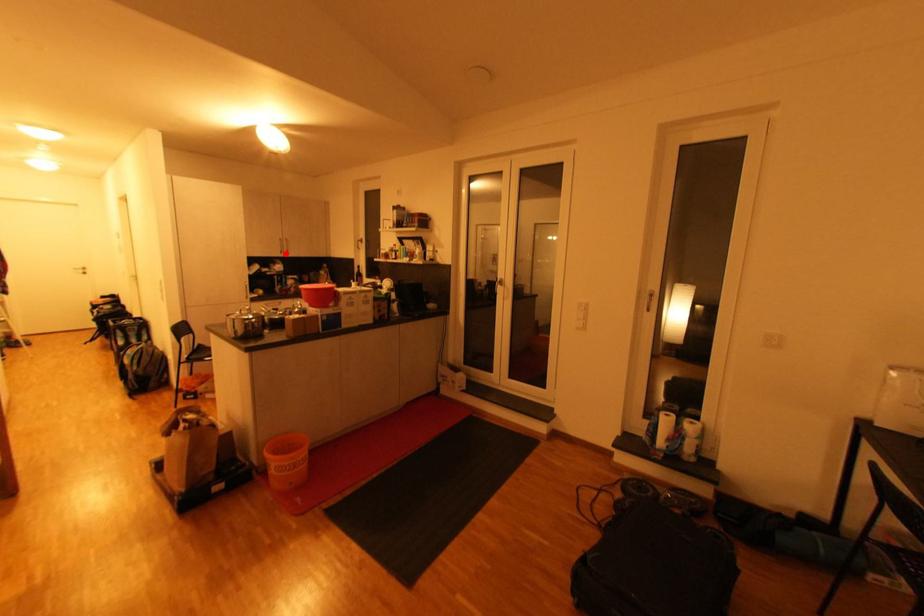
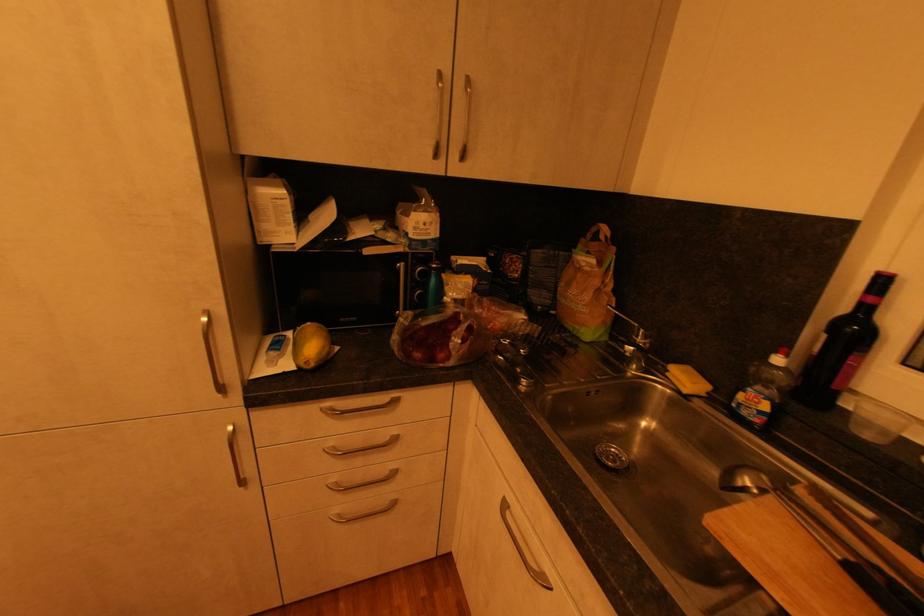
Locate, in the second image, the point that corresponds to the highlighted location in the first image.

(441, 156)